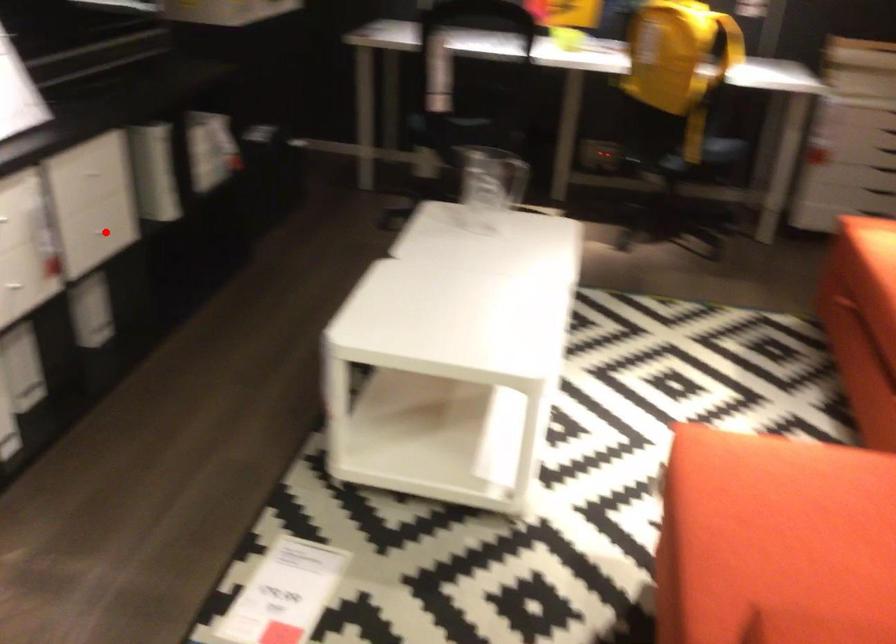
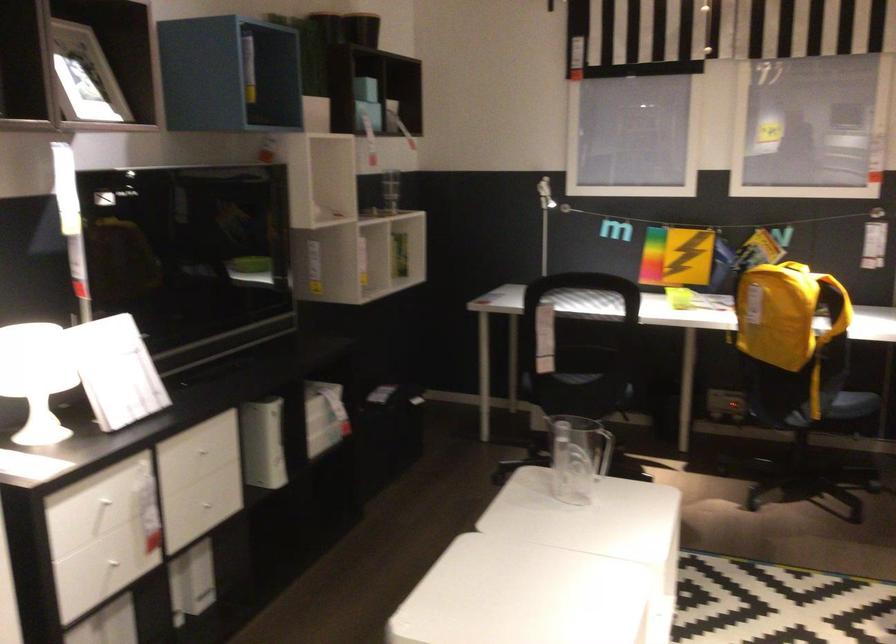
Locate, in the second image, the point that corresponds to the highlighted location in the first image.

(209, 504)